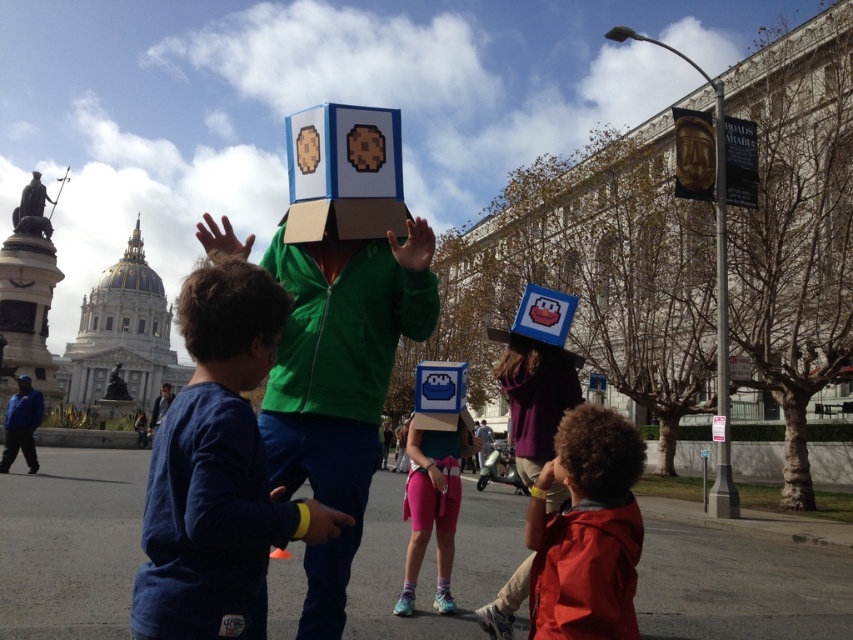
You are at an outdoor event and see two people wearing pixelated cardboard boxes. The person wearing a matte red jacket at lower right and the person wearing a matte green jacket at center. Which person is closer to you?

The matte red jacket at lower right is in front of the matte green jacket at center, so the person wearing the matte red jacket at lower right is closer to you.

You are standing in the crowd at this event and notice two points marked in the image. The first point is at coordinates point (248, 356), and the second is at point (16, 378). Which of these points is nearer to you?

Point (248, 356) is closer to the viewer than point (16, 378).